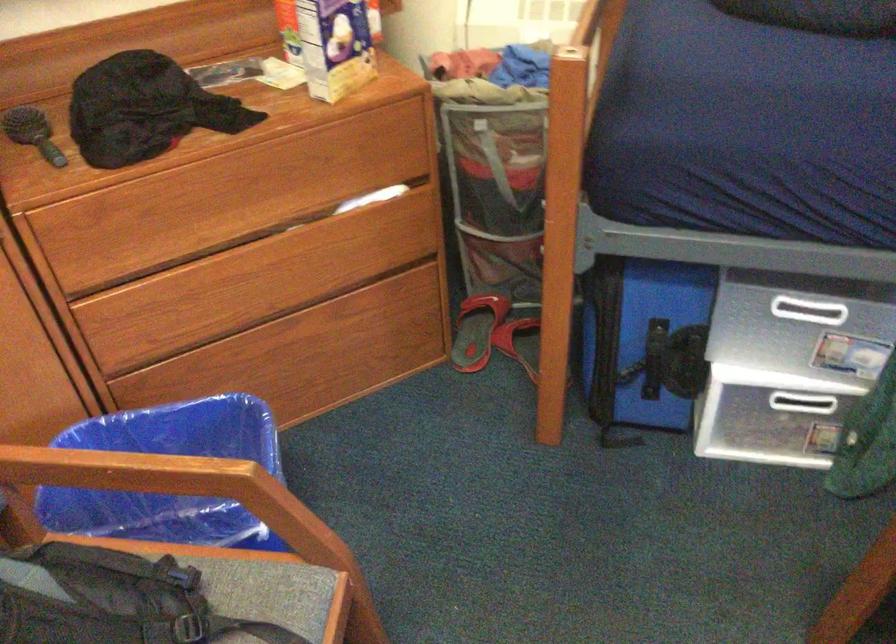
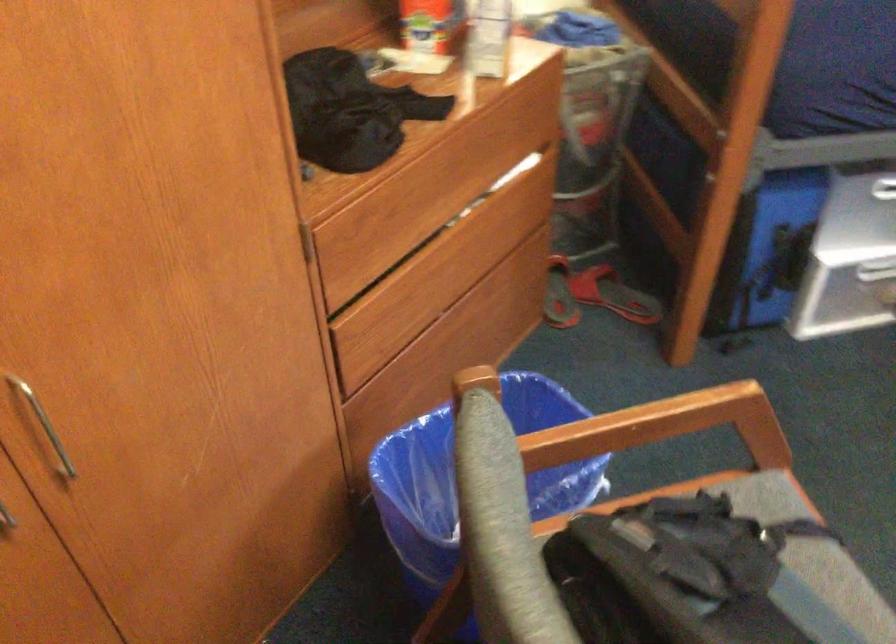
Locate, in the second image, the point that corresponds to (x=478, y=337) in the first image.

(558, 295)